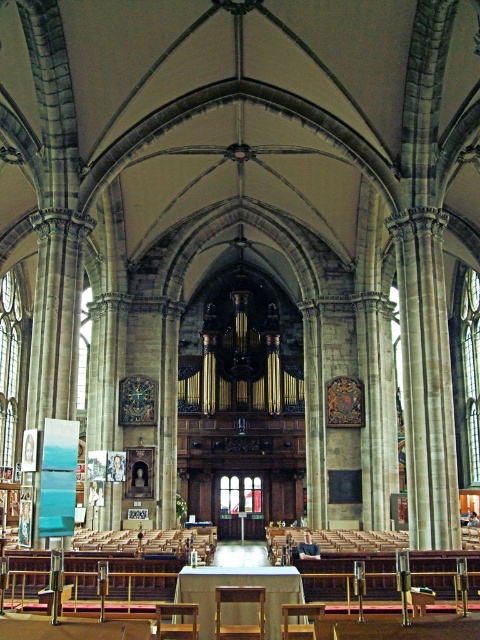
You are a visitor standing at the entrance of the cathedral. You notice two chairs in the scene. The first is a brown wooden chair at center, and the second is a wooden chair at lower center. Which chair do you think is taller?

The wooden chair at lower center is taller than the brown wooden chair at center.

You are standing at the entrance of the cathedral and want to sit down. There is a wooden chair at lower center. Can you walk directly to it without moving around any obstacles?

The wooden chair at lower center is positioned at point (x=176, y=620), which likely means it is near the center of the lower part of the image. Since the scene describes a grand cathedral with tall columns and a nave leading to the organ, there are no mentioned obstacles blocking the path from the entrance to the chair. Therefore, you can walk directly to the wooden chair at lower center without needing to move around any obstacles.